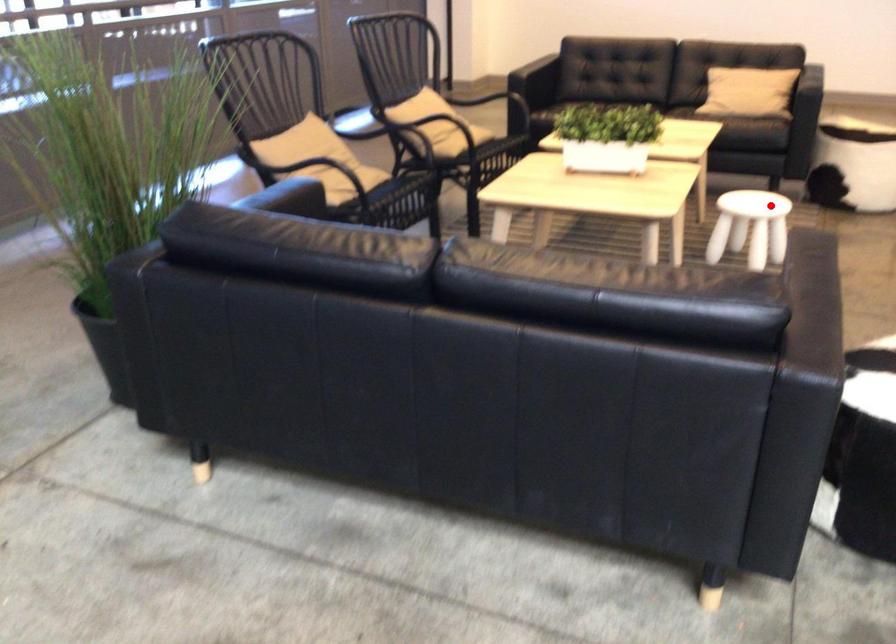
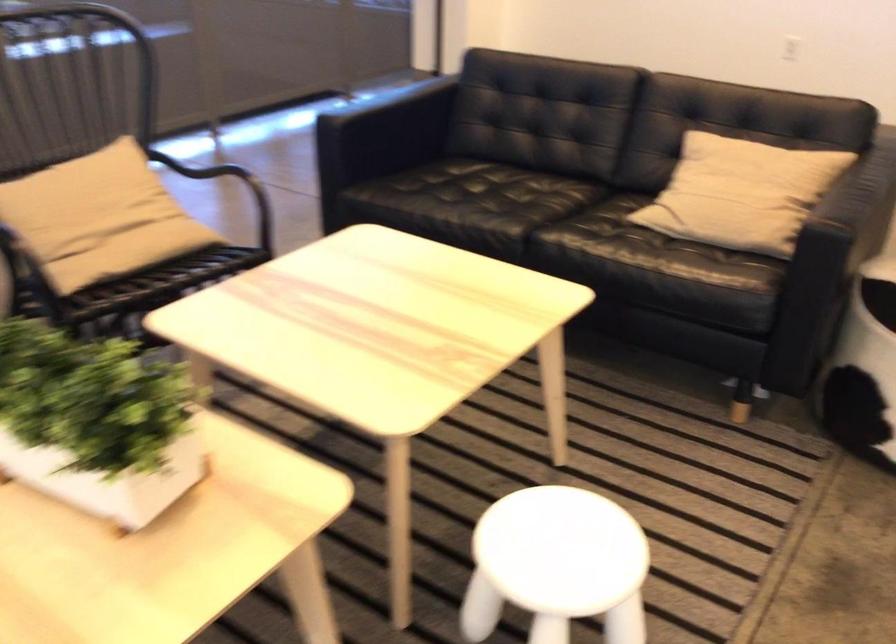
Question: I am providing you with two images of the same scene from different viewpoints. A red point is marked on the first image. Can you still see the location of the red point in image 2?

Choices:
 (A) Yes
 (B) No

Answer: (A)